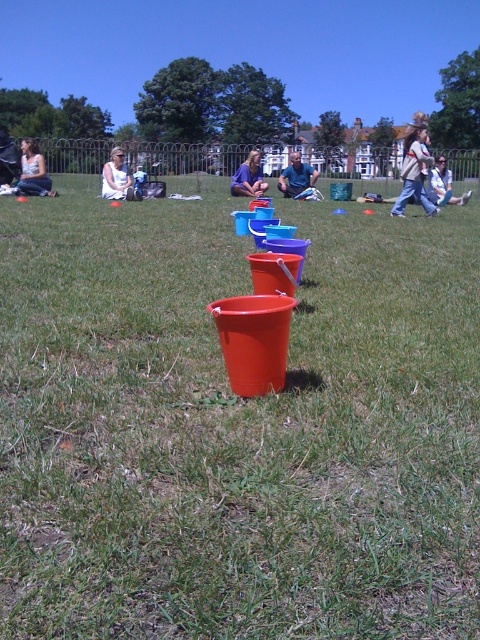
Who is taller, green grass at center or light blue denim jacket at upper right?

light blue denim jacket at upper right

Does green grass at center have a larger size compared to light blue denim jacket at upper right?

No.

Does point (184, 218) come farther from viewer compared to point (445, 186)?

No, it is in front of (445, 186).

Identify the location of green grass at center. (236, 428).

Does point (409, 154) come in front of point (431, 193)?

Yes, it is.

Can you confirm if denim jacket at upper center is positioned above light blue denim jacket at upper right?

No, denim jacket at upper center is not above light blue denim jacket at upper right.

The height and width of the screenshot is (640, 480). What are the coordinates of `denim jacket at upper center` in the screenshot? It's located at (415, 168).

Who is more forward, (431, 202) or (37, 193)?

Point (431, 202)

Locate an element on the screen. This screenshot has height=640, width=480. denim jacket at upper center is located at coordinates (415, 168).